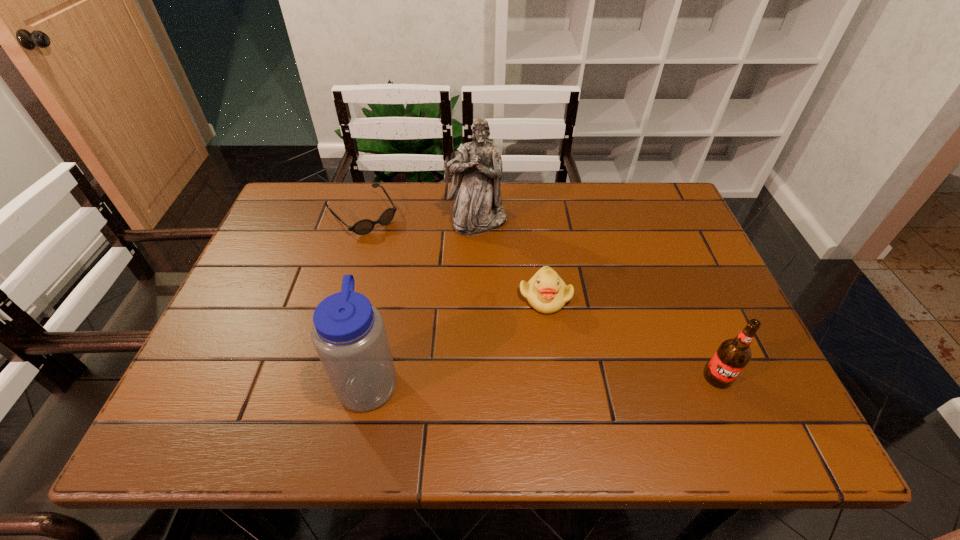
Identify the location of free space located 0.160m on the front-facing side of the second object from right to left. This screenshot has width=960, height=540. (586, 373).

Find the location of a particular element. Image resolution: width=960 pixels, height=540 pixels. blank space located 0.070m on the front-facing side of the second object from right to left is located at coordinates (567, 339).

Find the location of `blank space located 0.070m on the front-facing side of the second object from right to left`. blank space located 0.070m on the front-facing side of the second object from right to left is located at coordinates (567, 339).

Image resolution: width=960 pixels, height=540 pixels. What are the coordinates of `vacant point located 0.280m on the front-facing side of the figurine` in the screenshot? It's located at (530, 309).

At what (x,y) coordinates should I click in order to perform the action: click on vacant region located 0.200m on the front-facing side of the figurine. Please return your answer as a coordinate pair (x, y). Looking at the image, I should click on (516, 286).

The height and width of the screenshot is (540, 960). What are the coordinates of `blank area located on the front-facing side of the figurine` in the screenshot? It's located at (x=547, y=338).

Identify the location of free space located on the lenses of the shortest object. The height and width of the screenshot is (540, 960). (403, 256).

The width and height of the screenshot is (960, 540). I want to click on vacant space located on the lenses of the shortest object, so click(403, 256).

The width and height of the screenshot is (960, 540). Find the location of `vacant space situated 0.170m on the lenses of the shortest object`. vacant space situated 0.170m on the lenses of the shortest object is located at coordinates (414, 267).

Image resolution: width=960 pixels, height=540 pixels. I want to click on figurine positioned at the far edge, so click(477, 170).